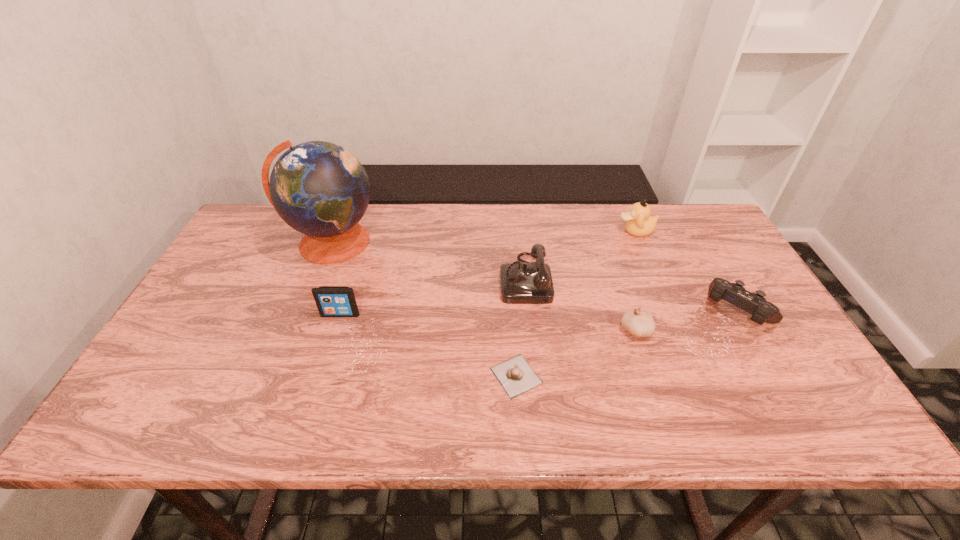
In order to click on vacant space that satisfies the following two spatial constraints: 1. on the face of the control; 2. on the left side of the sixth object from left to right in this screenshot , I will do `click(669, 311)`.

Where is `free space that satisfies the following two spatial constraints: 1. on the dial of the telephone; 2. on the back side of the control`? The image size is (960, 540). free space that satisfies the following two spatial constraints: 1. on the dial of the telephone; 2. on the back side of the control is located at coordinates (529, 311).